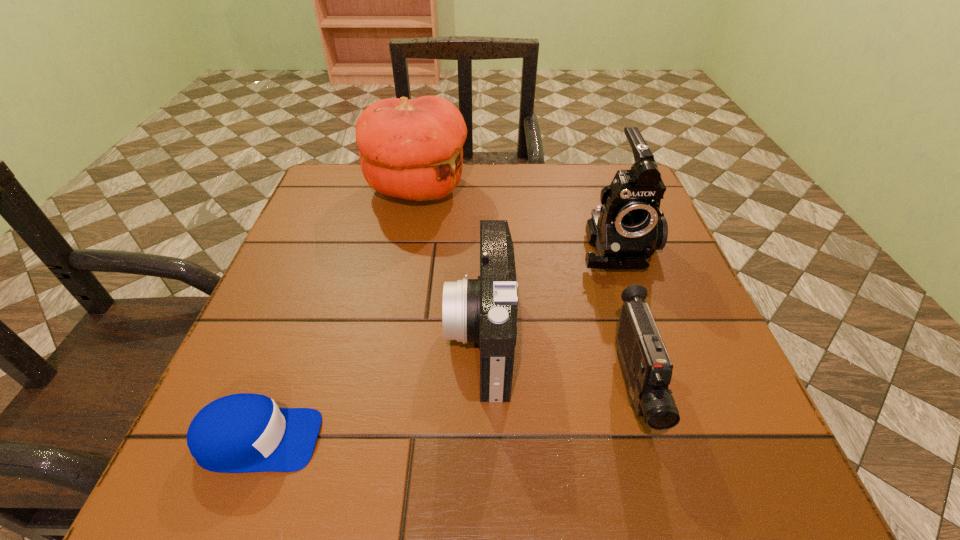
Locate an element on the screen. The width and height of the screenshot is (960, 540). vacant area that lies between the farthest object and the third shortest object is located at coordinates (448, 262).

Image resolution: width=960 pixels, height=540 pixels. Find the location of `vacant area that lies between the second shortest object and the farthest object`. vacant area that lies between the second shortest object and the farthest object is located at coordinates (524, 287).

This screenshot has width=960, height=540. Find the location of `free spot between the pumpkin and the third tallest object`. free spot between the pumpkin and the third tallest object is located at coordinates (448, 262).

The width and height of the screenshot is (960, 540). Identify the location of free spot between the pumpkin and the shortest camcorder. (524, 287).

The image size is (960, 540). Identify the location of vacant region between the fourth tallest object and the leftmost camcorder. (556, 361).

Find the location of a particular element. This screenshot has height=540, width=960. free spot between the shortest object and the leftmost camcorder is located at coordinates (370, 388).

Image resolution: width=960 pixels, height=540 pixels. In order to click on vacant area that lies between the farthest camcorder and the baseball cap in this screenshot , I will do `click(437, 343)`.

At what (x,y) coordinates should I click in order to perform the action: click on object that is the closest to the shortest camcorder. Please return your answer as a coordinate pair (x, y). Looking at the image, I should click on (628, 228).

The height and width of the screenshot is (540, 960). Find the location of `object that is the third closest one to the tallest camcorder`. object that is the third closest one to the tallest camcorder is located at coordinates (412, 149).

Choose which camcorder is the second nearest neighbor to the second tallest camcorder. Please provide its 2D coordinates. Your answer should be formatted as a tuple, i.e. [(x, y)], where the tuple contains the x and y coordinates of a point satisfying the conditions above.

[(647, 369)]